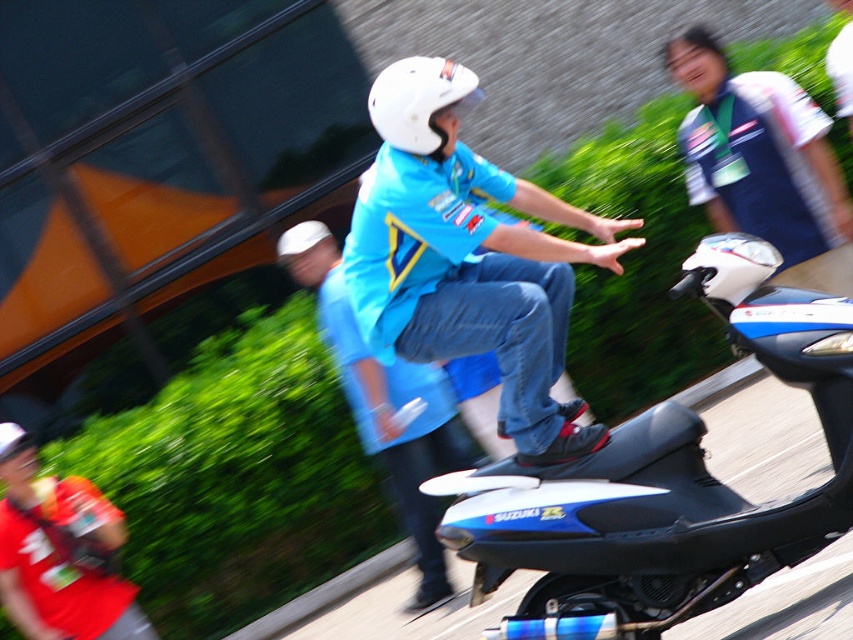
Between white jersey at upper right and red shirt at lower left, which one appears on the right side from the viewer's perspective?

Positioned to the right is white jersey at upper right.

Between white jersey at upper right and red shirt at lower left, which one has less height?

Standing shorter between the two is red shirt at lower left.

In order to click on white jersey at upper right in this screenshot , I will do `click(762, 161)`.

Between blue matte shirt at center and red shirt at lower left, which one is positioned lower?

red shirt at lower left is below.

Is blue matte shirt at center smaller than red shirt at lower left?

Actually, blue matte shirt at center might be larger than red shirt at lower left.

Find the location of a particular element. The image size is (853, 640). blue matte shirt at center is located at coordinates (468, 257).

The image size is (853, 640). I want to click on blue matte shirt at center, so click(468, 257).

Who is positioned more to the left, blue glossy scooter at center or white matte helmet at center?

white matte helmet at center

Which is below, blue glossy scooter at center or white matte helmet at center?

blue glossy scooter at center is below.

Image resolution: width=853 pixels, height=640 pixels. Find the location of `blue glossy scooter at center`. blue glossy scooter at center is located at coordinates (665, 483).